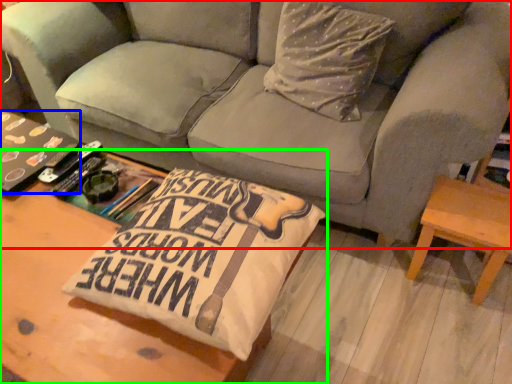
Question: Based on their relative distances, which object is nearer to studio couch (highlighted by a red box)? Choose from book (highlighted by a blue box) and table (highlighted by a green box).

Choices:
 (A) book
 (B) table

Answer: (A)